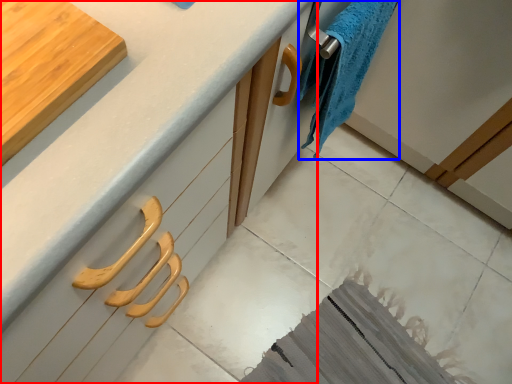
Question: Which of the following is the farthest to the observer, countertop (highlighted by a red box) or bath towel (highlighted by a blue box)?

Choices:
 (A) countertop
 (B) bath towel

Answer: (B)